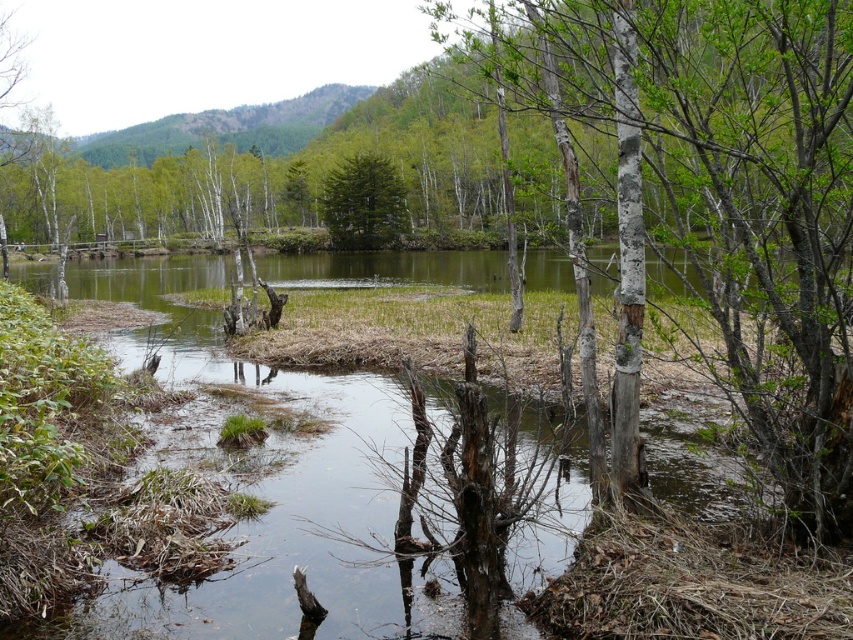
You are standing at the edge of the pond and see two trees at the center. Which tree is to the right of the other? The smooth bark tree at center or the green matte tree at center?

The smooth bark tree at center is positioned on the right side of the green matte tree at center.

You are standing in the middle of the wetland area and see both the smooth bark tree at center and the green matte tree at center. Which tree would appear larger to you?

The smooth bark tree at center is closer to the viewer than the green matte tree at center, so it would appear larger.

You are an environmental scientist studying the trees in the scene. You need to determine which tree is taller between the smooth bark tree at center and the green matte tree at center. Based on the scene, which one is taller?

The smooth bark tree at center is taller than the green matte tree at center according to the description.